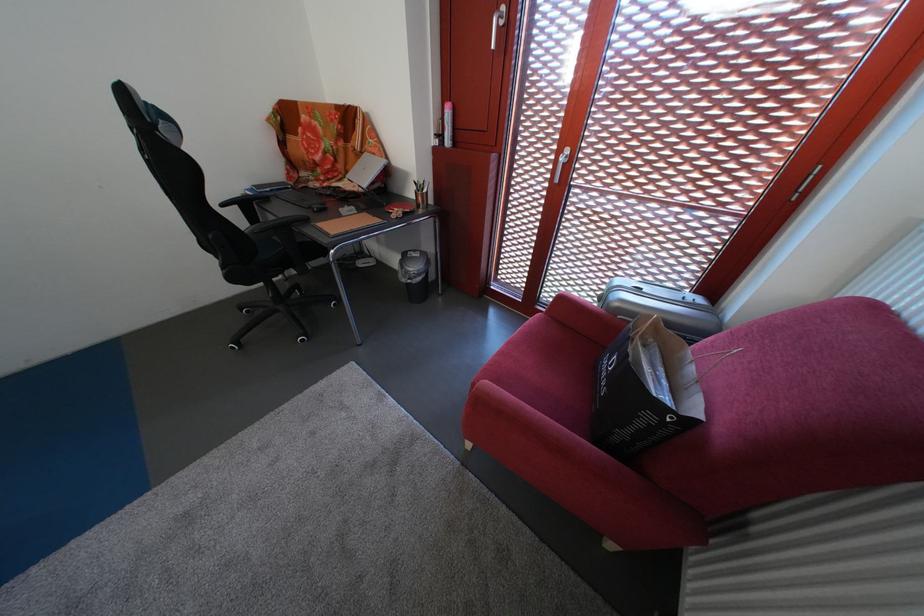
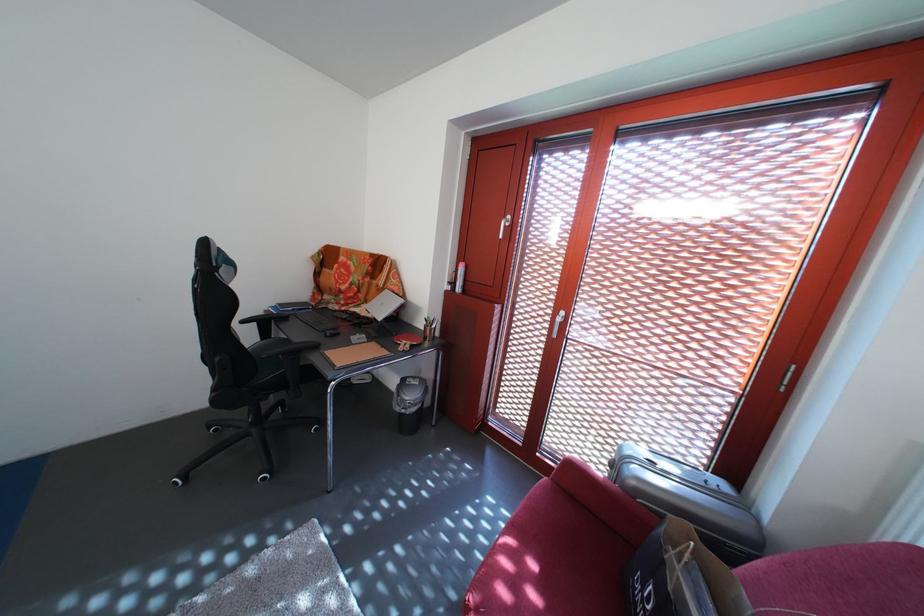
Where in the second image is the point corresponding to [262,224] from the first image?

(275, 339)